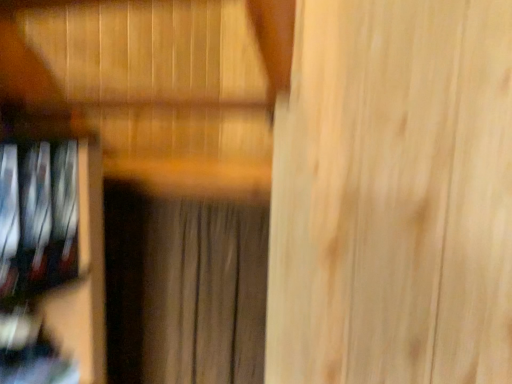
Question: From the image's perspective, is brown textured curtain at center on metallic silver dvds at left?

Choices:
 (A) yes
 (B) no

Answer: (B)

Question: Can you confirm if brown textured curtain at center is taller than metallic silver dvds at left?

Choices:
 (A) yes
 (B) no

Answer: (A)

Question: Would you consider brown textured curtain at center to be distant from metallic silver dvds at left?

Choices:
 (A) yes
 (B) no

Answer: (B)

Question: Can you confirm if brown textured curtain at center is bigger than metallic silver dvds at left?

Choices:
 (A) yes
 (B) no

Answer: (A)

Question: Is the depth of brown textured curtain at center greater than that of metallic silver dvds at left?

Choices:
 (A) no
 (B) yes

Answer: (B)

Question: From a real-world perspective, is brown textured curtain at center physically below metallic silver dvds at left?

Choices:
 (A) no
 (B) yes

Answer: (B)

Question: Can you confirm if metallic silver dvds at left is shorter than brown textured curtain at center?

Choices:
 (A) yes
 (B) no

Answer: (A)

Question: Can you confirm if metallic silver dvds at left is bigger than brown textured curtain at center?

Choices:
 (A) no
 (B) yes

Answer: (A)

Question: Does metallic silver dvds at left appear on the left side of brown textured curtain at center?

Choices:
 (A) yes
 (B) no

Answer: (A)

Question: From a real-world perspective, is metallic silver dvds at left beneath brown textured curtain at center?

Choices:
 (A) yes
 (B) no

Answer: (B)

Question: Is metallic silver dvds at left positioned before brown textured curtain at center?

Choices:
 (A) no
 (B) yes

Answer: (B)

Question: Considering the relative sizes of metallic silver dvds at left and brown textured curtain at center in the image provided, is metallic silver dvds at left thinner than brown textured curtain at center?

Choices:
 (A) no
 (B) yes

Answer: (A)

Question: In terms of size, does brown textured curtain at center appear bigger or smaller than metallic silver dvds at left?

Choices:
 (A) big
 (B) small

Answer: (A)